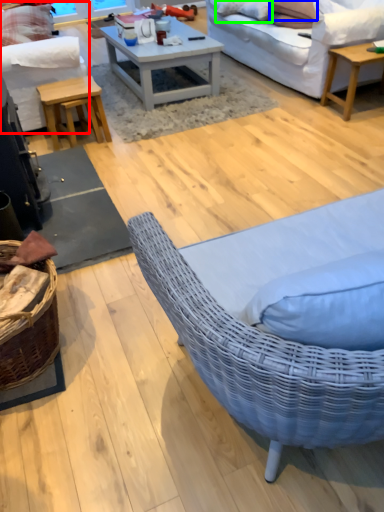
Question: Which object is positioned farthest from studio couch (highlighted by a red box)? Select from pillow (highlighted by a blue box) and pillow (highlighted by a green box).

Choices:
 (A) pillow
 (B) pillow

Answer: (A)